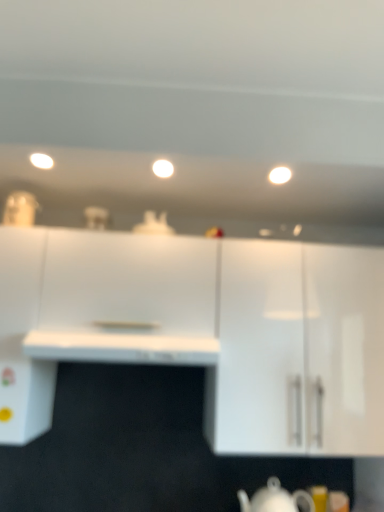
At what (x,y) coordinates should I click in order to perform the action: click on free spot to the left of white glossy light fixture at upper left, which is the first lighting from left to right. Please return your answer as a coordinate pair (x, y). Image resolution: width=384 pixels, height=512 pixels. Looking at the image, I should click on (17, 160).